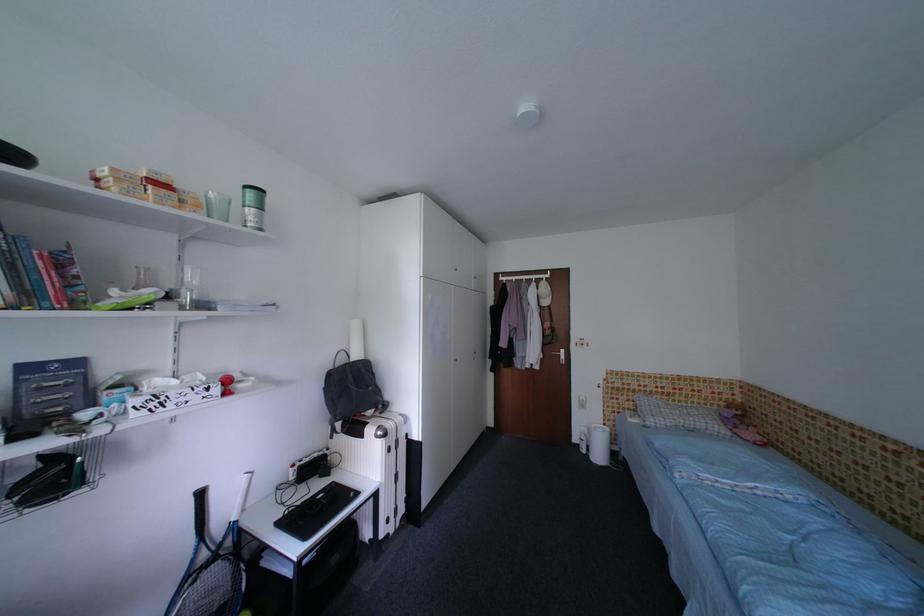
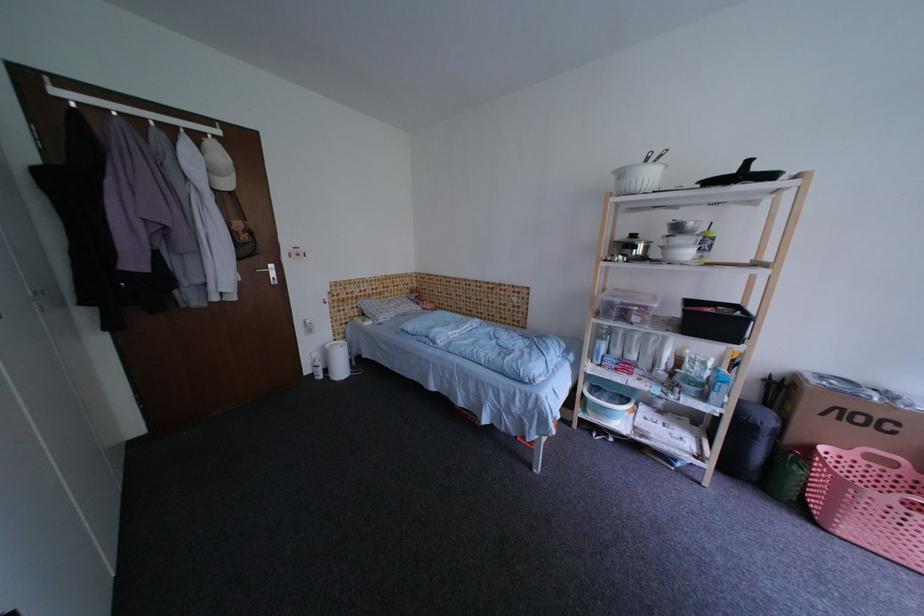
Locate, in the second image, the point that corresponds to point (591, 440) in the first image.

(326, 366)